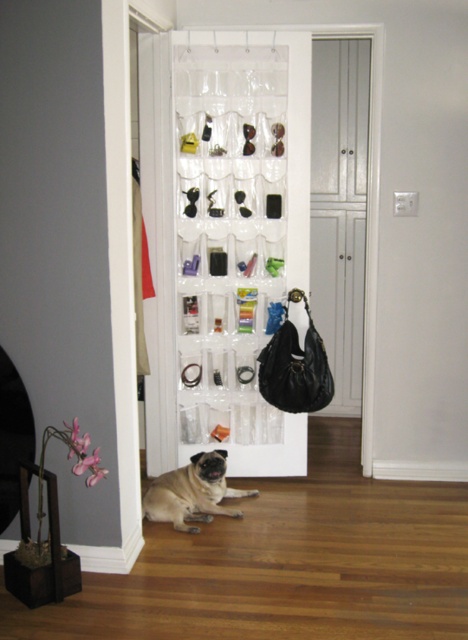
You are standing in front of the closet and want to place a small item at the point marked as point (279, 404). If your arm can reach up to 10 feet, can you comfortably reach that point?

The distance of point (279, 404) from viewer is 10.85 feet, which is slightly beyond your arm reach of 10 feet. You might need to take a step closer or use a tool to reach it.

You are trying to decide where to place a new 12 inch tall decorative vase. The clear plastic organizer at center and the white glossy cabinet at center are both options. Based on their heights, which one can accommodate the vase without it being too tall?

The white glossy cabinet at center is taller than the clear plastic organizer at center, so the vase will fit better on the white glossy cabinet at center.